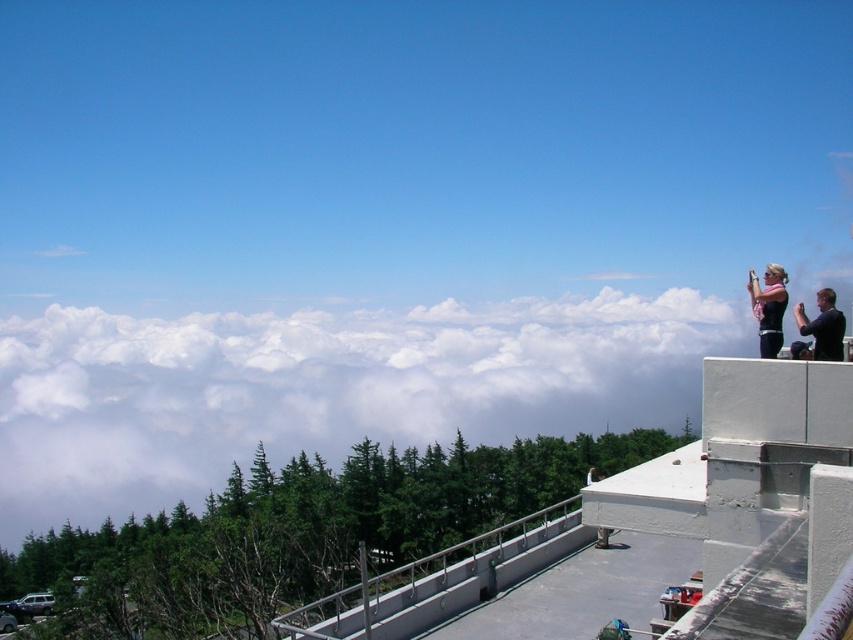
You are standing on the observation deck and want to take a photo of the dark hair person at upper right without including the satin silver railing at center in the frame. Is this possible given their sizes?

The satin silver railing at center is smaller than the dark hair person at upper right, so it is possible to frame the photo to exclude the railing by focusing on the larger dark hair person at upper right.

You are a photographer trying to capture the two people on the observation deck. The camera you have can only focus on objects wider than 30cm. Given the black matte shirt at upper right and the dark hair person at upper right, which one will your camera focus on?

The black matte shirt at upper right is less than 30cm wide, while the dark hair person at upper right is wider. Therefore, the camera will focus on the dark hair person at upper right since it exceeds the minimum width requirement of 30cm.